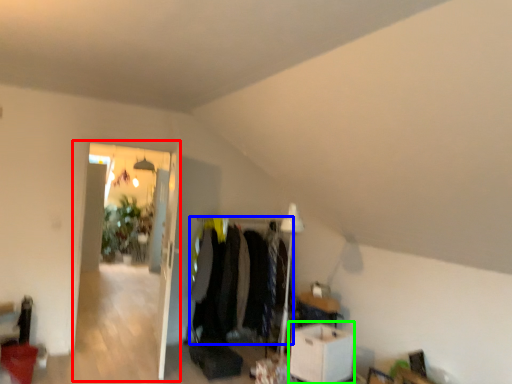
Question: Estimate the real-world distances between objects in this image. Which object is closer to glass door (highlighted by a red box), clothing (highlighted by a blue box) or table (highlighted by a green box)?

Choices:
 (A) clothing
 (B) table

Answer: (A)